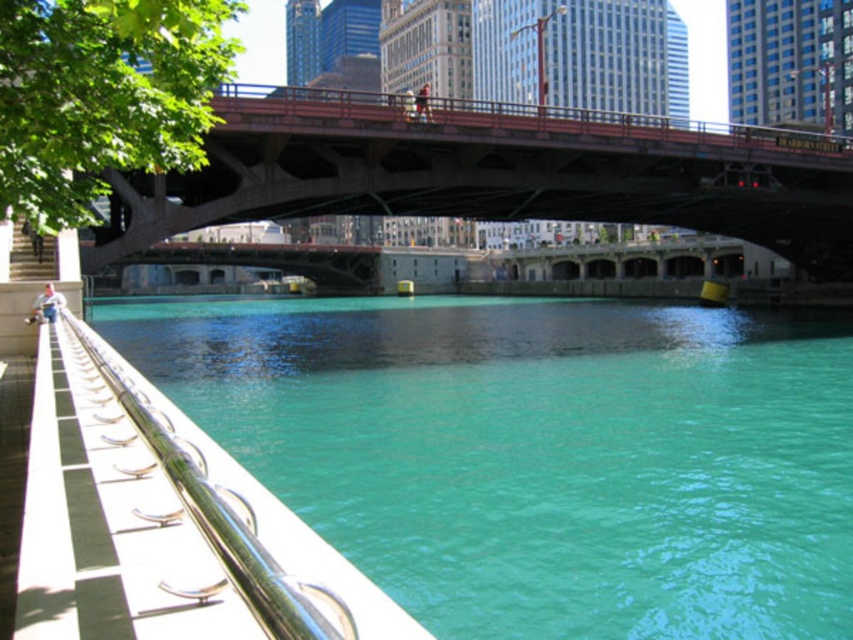
Question: Which point is closer to the camera?

Choices:
 (A) (349, 112)
 (B) (669, 337)

Answer: (A)

Question: Among these objects, which one is nearest to the camera?

Choices:
 (A) concrete bridge at center
 (B) teal glossy water at center

Answer: (B)

Question: Among these objects, which one is farthest from the camera?

Choices:
 (A) concrete bridge at center
 (B) teal glossy water at center

Answer: (A)

Question: Does teal glossy water at center come in front of concrete bridge at center?

Choices:
 (A) yes
 (B) no

Answer: (A)

Question: Is teal glossy water at center behind concrete bridge at center?

Choices:
 (A) no
 (B) yes

Answer: (A)

Question: Is teal glossy water at center smaller than concrete bridge at center?

Choices:
 (A) yes
 (B) no

Answer: (B)